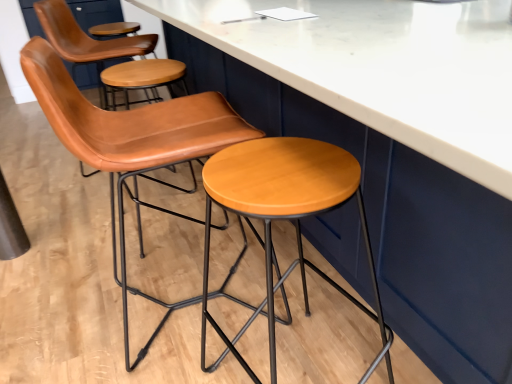
Question: Is point (231, 210) positioned closer to the camera than point (124, 160)?

Choices:
 (A) farther
 (B) closer

Answer: (A)

Question: From a real-world perspective, is wooden/matte stool at center positioned above or below leather at center?

Choices:
 (A) below
 (B) above

Answer: (A)

Question: Is wooden/matte stool at center in front of or behind leather at center in the image?

Choices:
 (A) behind
 (B) front

Answer: (B)

Question: In terms of width, does leather at center look wider or thinner when compared to wooden/matte stool at center?

Choices:
 (A) thin
 (B) wide

Answer: (B)

Question: Visually, is leather at center positioned to the left or to the right of wooden/matte stool at center?

Choices:
 (A) left
 (B) right

Answer: (A)

Question: From a real-world perspective, is leather at center physically located above or below wooden/matte stool at center?

Choices:
 (A) below
 (B) above

Answer: (B)

Question: From the image's perspective, is leather at center located above or below wooden/matte stool at center?

Choices:
 (A) below
 (B) above

Answer: (B)